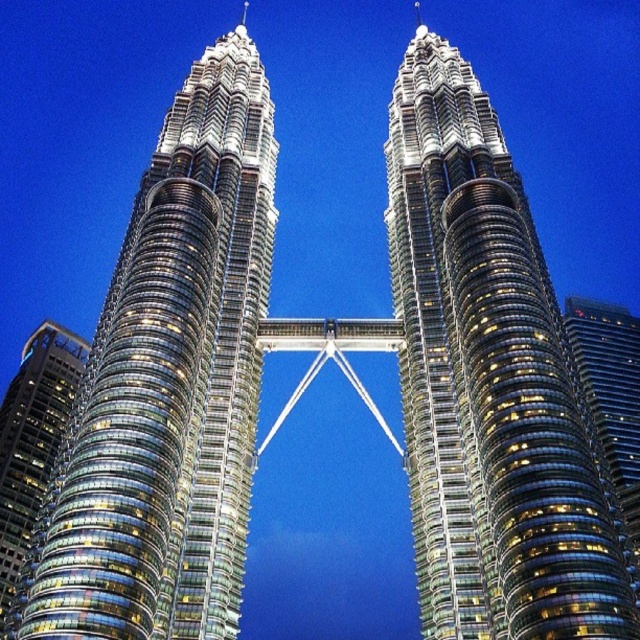
You are standing at the point marked as point (170, 385). Which object is directly in front of you?

The glassy metallic skyscraper at center is located at point (170, 385), so it is directly in front of you.

Based on the provided scene description, where is the glassy metallic skyscraper at center located in the image? Please provide its coordinates in the format of point followed by the coordinate values.

The glassy metallic skyscraper at center is located at point [170,385].